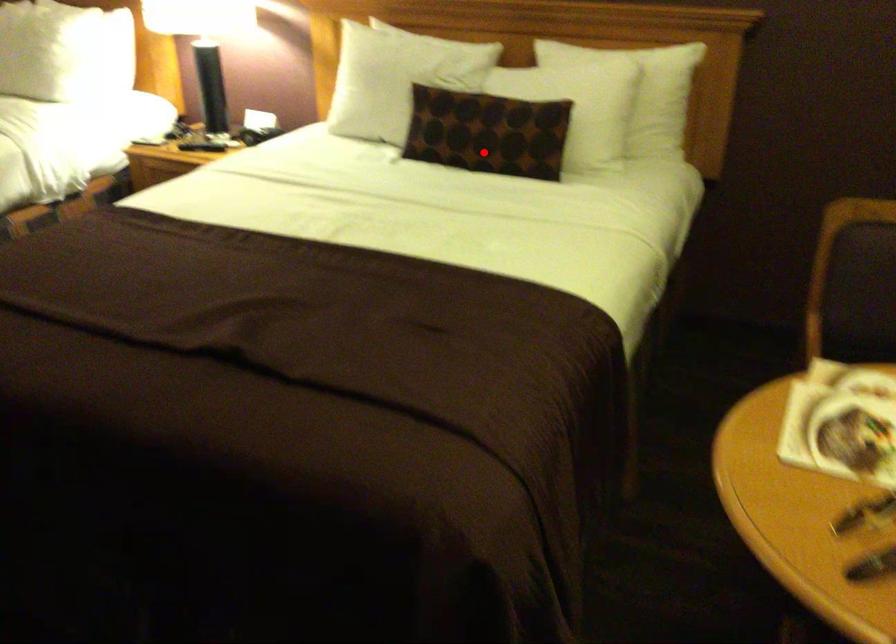
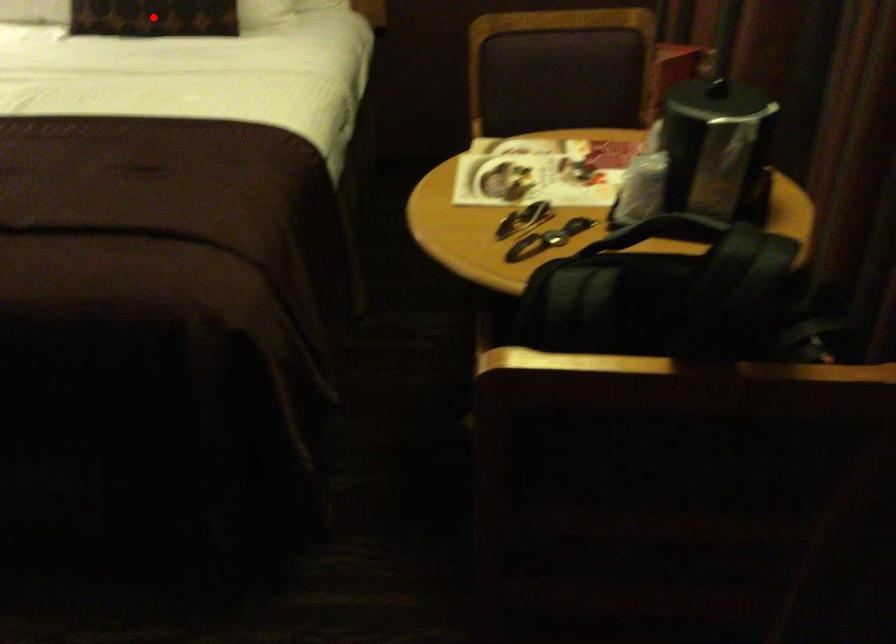
I am providing you with two images of the same scene from different viewpoints. A red point is marked on the first image and another point is marked on the second image. Is the marked point in image1 the same physical position as the marked point in image2?

Yes